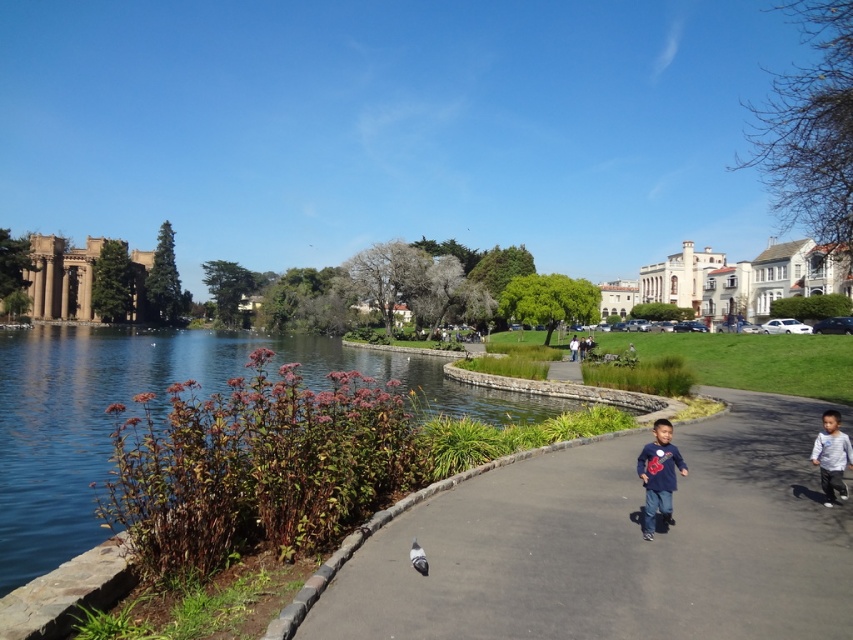
You are a photographer standing at the park entrance and see two people wearing the dark blue shirt at center and the light gray cotton shirt at lower right. Which person is positioned lower in the frame?

The dark blue shirt at center is positioned lower than the light gray cotton shirt at lower right in the frame.

Based on the photo, you are standing at the entrance of the park and want to reach the stone bridge. According to the image, where is the smooth asphalt path at center located in relation to the stone bridge?

The smooth asphalt path at center is located at point (616, 545), so it is positioned to the right and slightly below the stone bridge in the image.